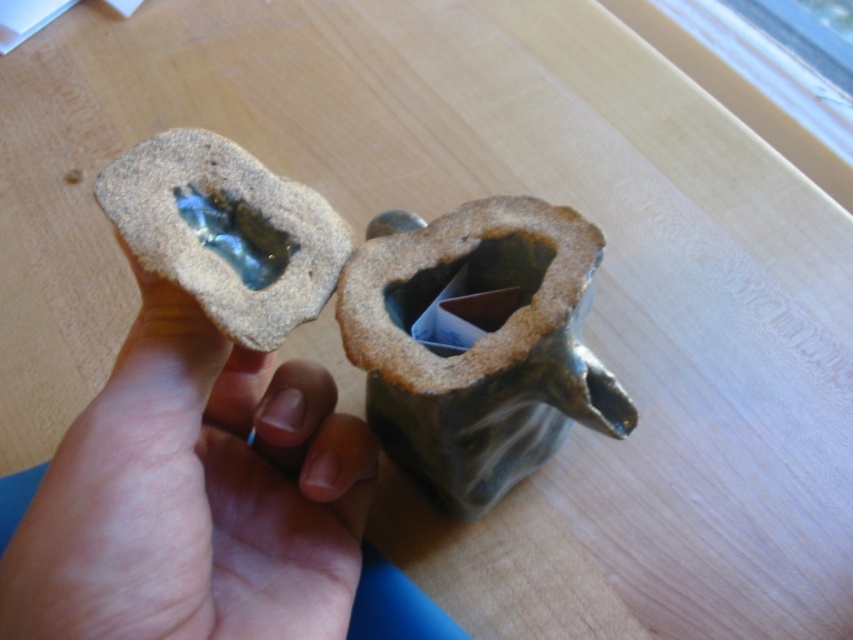
Can you confirm if green matte vase at center is positioned to the left of translucent glass at center?

In fact, green matte vase at center is to the right of translucent glass at center.

Who is lower down, green matte vase at center or translucent glass at center?

green matte vase at center

Locate an element on the screen. green matte vase at center is located at coordinates (479, 346).

This screenshot has width=853, height=640. What are the coordinates of `green matte vase at center` in the screenshot? It's located at (479, 346).

Does matte brown hand at center appear on the right side of translucent glass at center?

No, matte brown hand at center is not to the right of translucent glass at center.

Does matte brown hand at center appear under translucent glass at center?

Correct, matte brown hand at center is located below translucent glass at center.

Is point (169, 563) farther from camera compared to point (254, 291)?

No, it is not.

Identify the location of matte brown hand at center. The height and width of the screenshot is (640, 853). (194, 496).

Does matte brown hand at center have a greater height compared to green matte vase at center?

Incorrect, matte brown hand at center's height is not larger of green matte vase at center's.

Locate an element on the screen. matte brown hand at center is located at coordinates (194, 496).

I want to click on matte brown hand at center, so tap(194, 496).